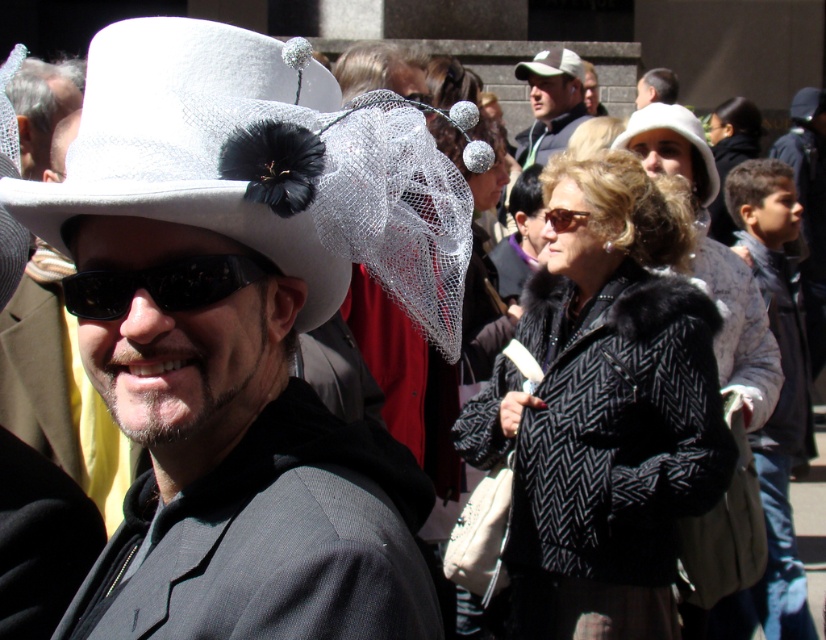
Who is higher up, light brown hair at right or matte brown sunglasses at center?

matte brown sunglasses at center is above.

Is light brown hair at right taller than matte brown sunglasses at center?

Yes.

Image resolution: width=826 pixels, height=640 pixels. What do you see at coordinates (779, 394) in the screenshot? I see `light brown hair at right` at bounding box center [779, 394].

Where is `light brown hair at right`? This screenshot has width=826, height=640. light brown hair at right is located at coordinates (779, 394).

Between white lace hat at upper center and white fabric hat at upper center, which one is positioned lower?

white lace hat at upper center is lower down.

Consider the image. Which is above, white lace hat at upper center or white fabric hat at upper center?

white fabric hat at upper center is higher up.

Which is behind, point (629, 125) or point (573, 54)?

The point (573, 54) is more distant.

At what (x,y) coordinates should I click in order to perform the action: click on white lace hat at upper center. Please return your answer as a coordinate pair (x, y). The image size is (826, 640). Looking at the image, I should click on (673, 131).

Between white textured hat at center and matte brown sunglasses at center, which one is positioned higher?

Positioned higher is matte brown sunglasses at center.

Between white textured hat at center and matte brown sunglasses at center, which one appears on the right side from the viewer's perspective?

Positioned to the right is matte brown sunglasses at center.

Which is in front, point (145, 122) or point (554, 212)?

Point (145, 122)

Find the location of a particular element. The height and width of the screenshot is (640, 826). white textured hat at center is located at coordinates (262, 166).